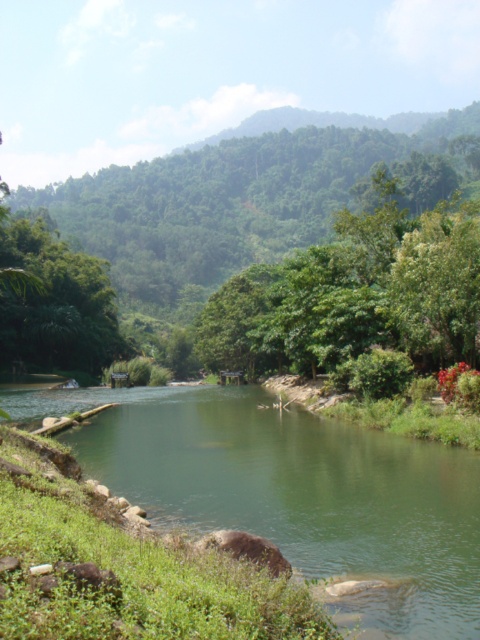
Who is higher up, green smooth river at center or green leafy tree at center?

green leafy tree at center is above.

Between point (72, 436) and point (347, 157), which one is positioned behind?

The point (347, 157) is behind.

Between point (472, 600) and point (232, 266), which one is positioned in front?

Point (472, 600) is more forward.

The width and height of the screenshot is (480, 640). I want to click on green smooth river at center, so click(x=294, y=492).